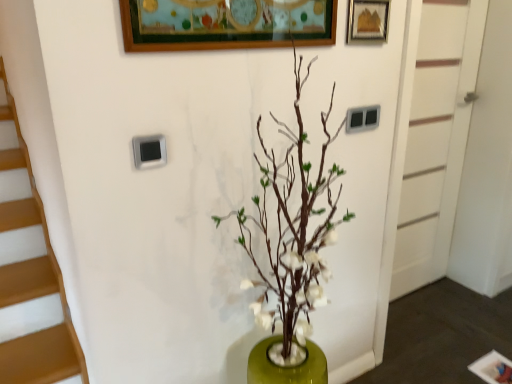
Question: Does green matte vase at center have a greater width compared to white painted wood door at right?

Choices:
 (A) yes
 (B) no

Answer: (A)

Question: Is green matte vase at center smaller than white painted wood door at right?

Choices:
 (A) no
 (B) yes

Answer: (A)

Question: Considering the relative sizes of green matte vase at center and white painted wood door at right in the image provided, is green matte vase at center shorter than white painted wood door at right?

Choices:
 (A) yes
 (B) no

Answer: (A)

Question: From a real-world perspective, does green matte vase at center sit lower than white painted wood door at right?

Choices:
 (A) yes
 (B) no

Answer: (B)

Question: Is the depth of green matte vase at center less than that of white painted wood door at right?

Choices:
 (A) no
 (B) yes

Answer: (B)

Question: In terms of width, does green matte vase at center look wider or thinner when compared to white painted wood door at right?

Choices:
 (A) wide
 (B) thin

Answer: (A)

Question: Is green matte vase at center in front of or behind white painted wood door at right in the image?

Choices:
 (A) behind
 (B) front

Answer: (B)

Question: From their relative heights in the image, would you say green matte vase at center is taller or shorter than white painted wood door at right?

Choices:
 (A) tall
 (B) short

Answer: (B)

Question: From a real-world perspective, is green matte vase at center physically located above or below white painted wood door at right?

Choices:
 (A) below
 (B) above

Answer: (B)

Question: Considering the positions of green matte vase at center and wooden picture frame at upper right in the image, is green matte vase at center taller or shorter than wooden picture frame at upper right?

Choices:
 (A) short
 (B) tall

Answer: (B)

Question: Is green matte vase at center bigger or smaller than wooden picture frame at upper right?

Choices:
 (A) small
 (B) big

Answer: (B)

Question: Which is correct: green matte vase at center is inside wooden picture frame at upper right, or outside of it?

Choices:
 (A) outside
 (B) inside

Answer: (A)

Question: Considering the positions of green matte vase at center and wooden picture frame at upper right in the image, is green matte vase at center wider or thinner than wooden picture frame at upper right?

Choices:
 (A) wide
 (B) thin

Answer: (A)

Question: From the image's perspective, is white painted wood door at right above or below green matte vase at center?

Choices:
 (A) below
 (B) above

Answer: (B)

Question: From their relative heights in the image, would you say white painted wood door at right is taller or shorter than green matte vase at center?

Choices:
 (A) short
 (B) tall

Answer: (B)